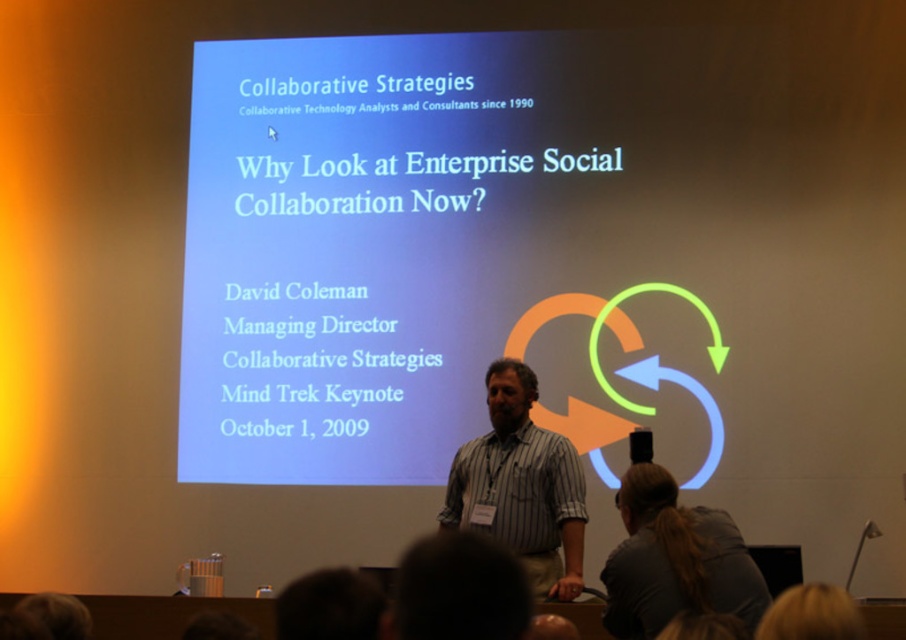
Question: Does striped cotton shirt at center have a greater width compared to blonde hair at upper center?

Choices:
 (A) yes
 (B) no

Answer: (B)

Question: Among these points, which one is farthest from the camera?

Choices:
 (A) (518, 468)
 (B) (521, 568)

Answer: (A)

Question: Can you confirm if striped cotton shirt at center is positioned above gray fabric ponytail at lower center?

Choices:
 (A) no
 (B) yes

Answer: (A)

Question: Is gray fabric ponytail at lower center thinner than blonde hair at upper center?

Choices:
 (A) no
 (B) yes

Answer: (A)

Question: Which object appears farthest from the camera in this image?

Choices:
 (A) striped cotton shirt at center
 (B) dark hair at lower center
 (C) blonde hair at upper center

Answer: (A)

Question: Which object is closer to the camera taking this photo?

Choices:
 (A) blonde hair at upper center
 (B) dark hair at lower center
 (C) gray fabric ponytail at lower center
 (D) striped cotton shirt at center

Answer: (A)